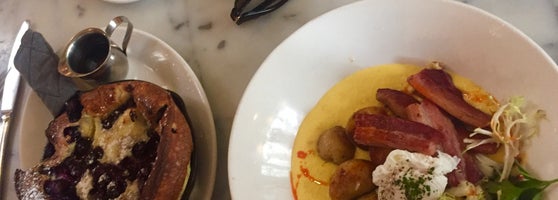
The height and width of the screenshot is (200, 558). Find the location of `big white bowl`. big white bowl is located at coordinates (350, 41).